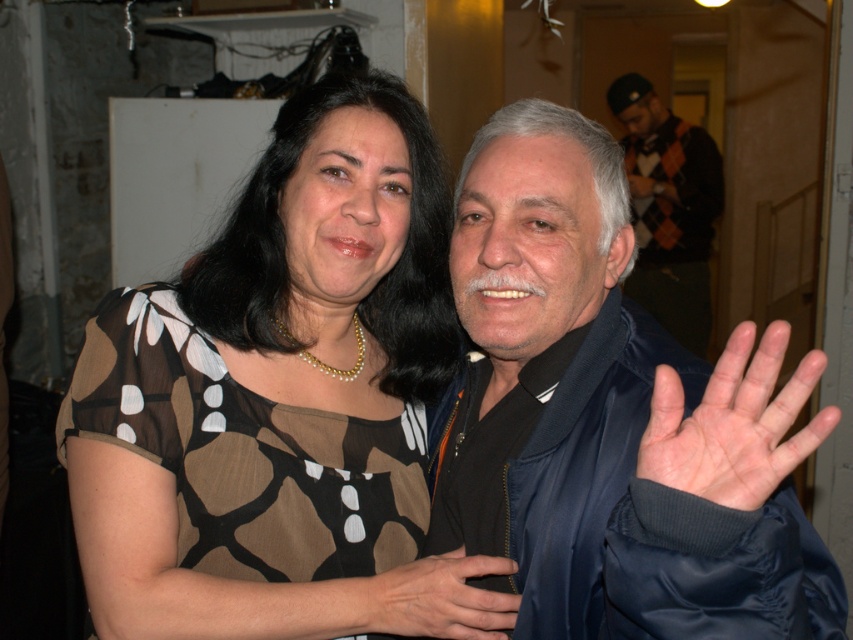
Who is more distant from viewer, (677, 602) or (664, 196)?

Point (664, 196)

Which is more to the right, satin blue jacket at right or argyle sweater at upper right?

argyle sweater at upper right

Locate an element on the screen. The width and height of the screenshot is (853, 640). satin blue jacket at right is located at coordinates (602, 419).

Does brown dotted dress at center appear under satin blue jacket at right?

No.

Is brown dotted dress at center positioned behind satin blue jacket at right?

Yes, it is.

Measure the distance between point (332, 186) and camera.

Point (332, 186) is 3.37 feet from camera.

In order to click on brown dotted dress at center in this screenshot , I will do `click(282, 385)`.

Is point (653, 266) positioned after point (436, 595)?

Yes, point (653, 266) is behind point (436, 595).

Can you confirm if argyle sweater at upper right is positioned above smooth black hand at center?

Indeed, argyle sweater at upper right is positioned over smooth black hand at center.

Find the location of a particular element. This screenshot has width=853, height=640. argyle sweater at upper right is located at coordinates (668, 209).